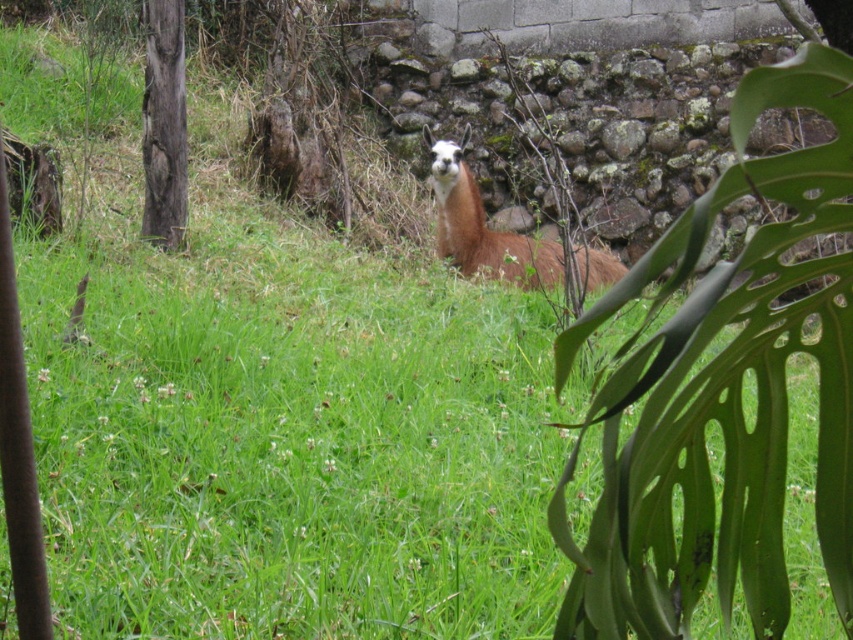
Between brown woolly alpaca at center and dark brown rough bark tree at left, which one has less height?

brown woolly alpaca at center is shorter.

Which is behind, point (583, 284) or point (161, 65)?

Point (161, 65)

In order to click on brown woolly alpaca at center in this screenshot , I will do `click(482, 225)`.